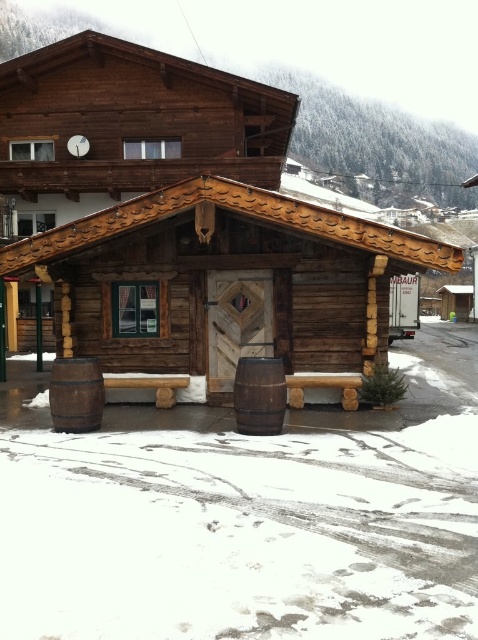
Is point (249, 422) farther from viewer compared to point (60, 376)?

No, (249, 422) is closer to viewer.

Is brown wooden barrel at lower center shorter than brown wooden barrel at lower left?

No.

Who is more forward, (242, 410) or (104, 403)?

Point (242, 410)

I want to click on brown wooden barrel at lower center, so click(x=259, y=396).

Who is higher up, wooden cabin at center or brown wooden barrel at lower center?

wooden cabin at center is higher up.

Can you confirm if wooden cabin at center is taller than brown wooden barrel at lower center?

Indeed, wooden cabin at center has a greater height compared to brown wooden barrel at lower center.

The image size is (478, 640). What are the coordinates of `wooden cabin at center` in the screenshot? It's located at (225, 288).

I want to click on wooden cabin at center, so click(225, 288).

Looking at this image, is wooden cabin at center below brown wooden barrel at lower left?

Actually, wooden cabin at center is above brown wooden barrel at lower left.

Does wooden cabin at center have a larger size compared to brown wooden barrel at lower left?

Yes.

Is point (191, 300) positioned before point (56, 426)?

No, (191, 300) is further to viewer.

Identify the location of wooden cabin at center. (225, 288).